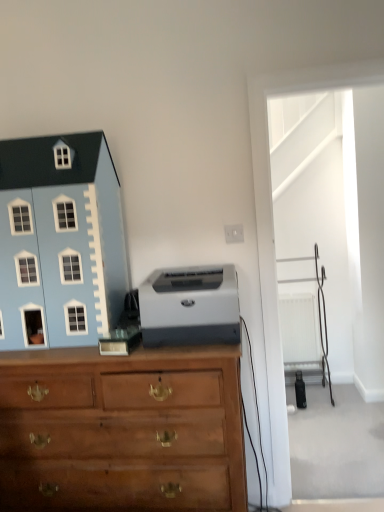
This screenshot has width=384, height=512. Find the location of `wooden chest of drawers at center`. wooden chest of drawers at center is located at coordinates (122, 430).

What do you see at coordinates (299, 332) in the screenshot? I see `white plastic radiator at right` at bounding box center [299, 332].

Identify the location of gray matte printer at center. The image size is (384, 512). (190, 307).

This screenshot has width=384, height=512. I want to click on wooden chest of drawers at center, so click(122, 430).

Does wooden chest of drawers at center have a lesser width compared to white plastic radiator at right?

No.

Considering the points (31, 379) and (314, 357), which point is in front, point (31, 379) or point (314, 357)?

The point (31, 379) is more forward.

Is wooden chest of drawers at center bigger than white plastic radiator at right?

Yes.

Considering the points (161, 344) and (47, 323), which point is behind, point (161, 344) or point (47, 323)?

Positioned behind is point (47, 323).

From a real-world perspective, does gray matte printer at center sit lower than light blue plastic toy house at left?

Yes, from a real-world perspective, gray matte printer at center is below light blue plastic toy house at left.

Would you say light blue plastic toy house at left is part of gray matte printer at center's contents?

Actually, light blue plastic toy house at left is outside gray matte printer at center.

How different are the orientations of gray matte printer at center and light blue plastic toy house at left in degrees?

0.651 degrees separate the facing orientations of gray matte printer at center and light blue plastic toy house at left.

From a real-world perspective, does gray matte printer at center sit lower than wooden chest of drawers at center?

Incorrect, from a real-world perspective, gray matte printer at center is higher than wooden chest of drawers at center.

Between gray matte printer at center and wooden chest of drawers at center, which one appears on the left side from the viewer's perspective?

From the viewer's perspective, wooden chest of drawers at center appears more on the left side.

Considering the relative sizes of gray matte printer at center and wooden chest of drawers at center in the image provided, is gray matte printer at center wider than wooden chest of drawers at center?

No, gray matte printer at center is not wider than wooden chest of drawers at center.

How many degrees apart are the facing directions of gray matte printer at center and wooden chest of drawers at center?

They differ by 2.12 degrees in their facing directions.

Between point (117, 271) and point (291, 322), which one is positioned behind?

The point (291, 322) is behind.

How much distance is there between light blue plastic toy house at left and white plastic radiator at right?

light blue plastic toy house at left and white plastic radiator at right are 6.97 feet apart.

Can you confirm if light blue plastic toy house at left is bigger than white plastic radiator at right?

Indeed, light blue plastic toy house at left has a larger size compared to white plastic radiator at right.

Is light blue plastic toy house at left to the right of white plastic radiator at right from the viewer's perspective?

No.

Consider the image. Is white plastic radiator at right oriented towards gray matte printer at center?

No, white plastic radiator at right is not oriented towards gray matte printer at center.

Find the location of a particular element. printer above the white plastic radiator at right (from a real-world perspective) is located at coordinates (190, 307).

Is white plastic radiator at right not near gray matte printer at center?

Yes, white plastic radiator at right and gray matte printer at center are quite far apart.

Which object is positioned more to the left, white plastic radiator at right or gray matte printer at center?

From the viewer's perspective, gray matte printer at center appears more on the left side.

Does light blue plastic toy house at left appear on the right side of gray matte printer at center?

In fact, light blue plastic toy house at left is to the left of gray matte printer at center.

From a real-world perspective, between light blue plastic toy house at left and gray matte printer at center, who is vertically lower?

In real-world perspective, gray matte printer at center is lower.

Looking at this image, who is smaller, light blue plastic toy house at left or gray matte printer at center?

With smaller size is gray matte printer at center.

Between light blue plastic toy house at left and gray matte printer at center, which one has more height?

Standing taller between the two is light blue plastic toy house at left.

Is white plastic radiator at right facing away from light blue plastic toy house at left?

No.

Locate an element on the screen. This screenshot has width=384, height=512. toy in front of the white plastic radiator at right is located at coordinates (60, 242).

Can you tell me how much white plastic radiator at right and light blue plastic toy house at left differ in facing direction?

The angle between the facing direction of white plastic radiator at right and the facing direction of light blue plastic toy house at left is 0.29 degrees.

Which is behind, point (296, 356) or point (95, 272)?

The point (296, 356) is farther from the camera.

The width and height of the screenshot is (384, 512). Find the location of `radiator behind the wooden chest of drawers at center`. radiator behind the wooden chest of drawers at center is located at coordinates (299, 332).

Image resolution: width=384 pixels, height=512 pixels. Identify the location of toy lying on the left of gray matte printer at center. (60, 242).

Which object lies nearer to the anchor point white plastic radiator at right, light blue plastic toy house at left or gray matte printer at center?

gray matte printer at center.

Considering their positions, is white plastic radiator at right positioned further to light blue plastic toy house at left than gray matte printer at center?

The object further to light blue plastic toy house at left is white plastic radiator at right.

From the picture: Which object lies nearer to the anchor point white plastic radiator at right, gray matte printer at center or light blue plastic toy house at left?

gray matte printer at center.

From the image, which object appears to be farther from wooden chest of drawers at center, light blue plastic toy house at left or white plastic radiator at right?

white plastic radiator at right is further to wooden chest of drawers at center.

Looking at the image, which one is located further to wooden chest of drawers at center, light blue plastic toy house at left or gray matte printer at center?

light blue plastic toy house at left.

Based on their spatial positions, is wooden chest of drawers at center or white plastic radiator at right further from gray matte printer at center?

white plastic radiator at right is further to gray matte printer at center.

Looking at the image, which one is located further to light blue plastic toy house at left, wooden chest of drawers at center or white plastic radiator at right?

Among the two, white plastic radiator at right is located further to light blue plastic toy house at left.

Estimate the real-world distances between objects in this image. Which object is closer to white plastic radiator at right, wooden chest of drawers at center or gray matte printer at center?

gray matte printer at center is positioned closer to the anchor white plastic radiator at right.

Image resolution: width=384 pixels, height=512 pixels. In order to click on printer between light blue plastic toy house at left and wooden chest of drawers at center in the vertical direction in this screenshot , I will do `click(190, 307)`.

The height and width of the screenshot is (512, 384). In order to click on printer positioned between wooden chest of drawers at center and white plastic radiator at right from near to far in this screenshot , I will do `click(190, 307)`.

In order to click on toy between gray matte printer at center and white plastic radiator at right from front to back in this screenshot , I will do `click(60, 242)`.

Identify the location of toy between wooden chest of drawers at center and white plastic radiator at right in the front-back direction. (60, 242).